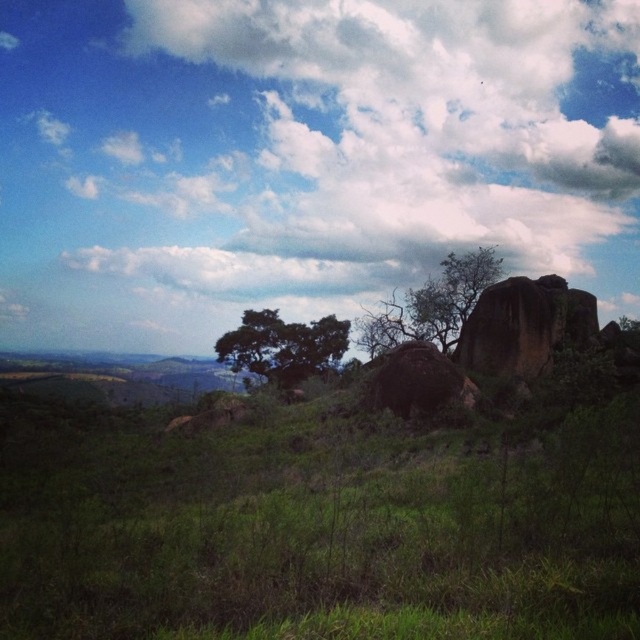
Question: Which is farther from the green leafy tree at upper right?

Choices:
 (A) white fluffy cloud at upper center
 (B) green leafy tree at center

Answer: (A)

Question: Can you confirm if white fluffy cloud at upper center is smaller than green leafy tree at center?

Choices:
 (A) no
 (B) yes

Answer: (A)

Question: Which of these objects is positioned farthest from the green leafy tree at upper right?

Choices:
 (A) white fluffy cloud at upper center
 (B) green leafy tree at center

Answer: (A)

Question: Is green leafy tree at upper right to the right of green leafy tree at center from the viewer's perspective?

Choices:
 (A) yes
 (B) no

Answer: (A)

Question: Is white fluffy cloud at upper center positioned before green leafy tree at upper right?

Choices:
 (A) yes
 (B) no

Answer: (A)

Question: Which point appears closest to the camera in this image?

Choices:
 (A) (445, 272)
 (B) (232, 349)
 (C) (97, 252)

Answer: (A)